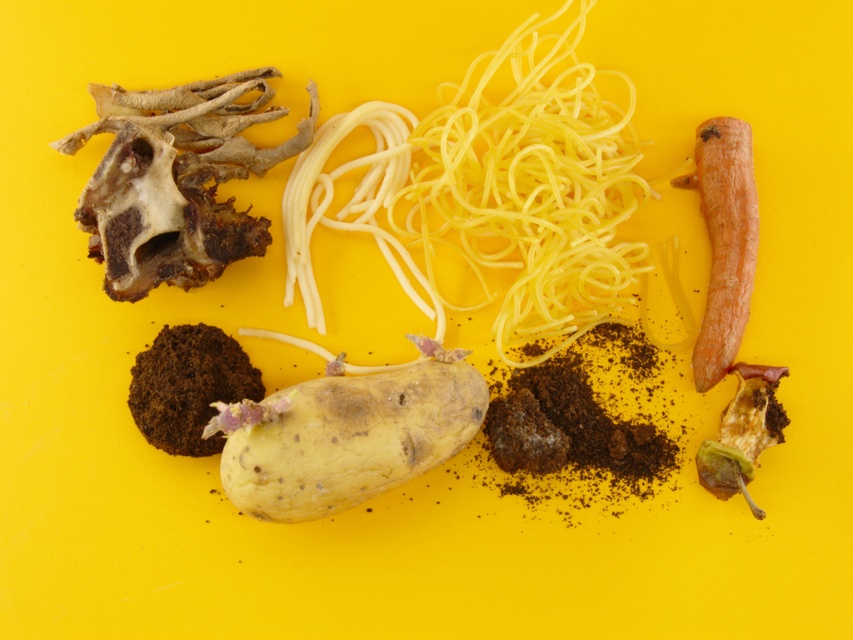
You are standing in front of the image and want to touch the two points labeled point (189, 381) and point (715, 452). Which point will require you to reach further back?

Point (715, 452) is further from the camera than point (189, 381), so you will need to reach further back to touch point (715, 452).